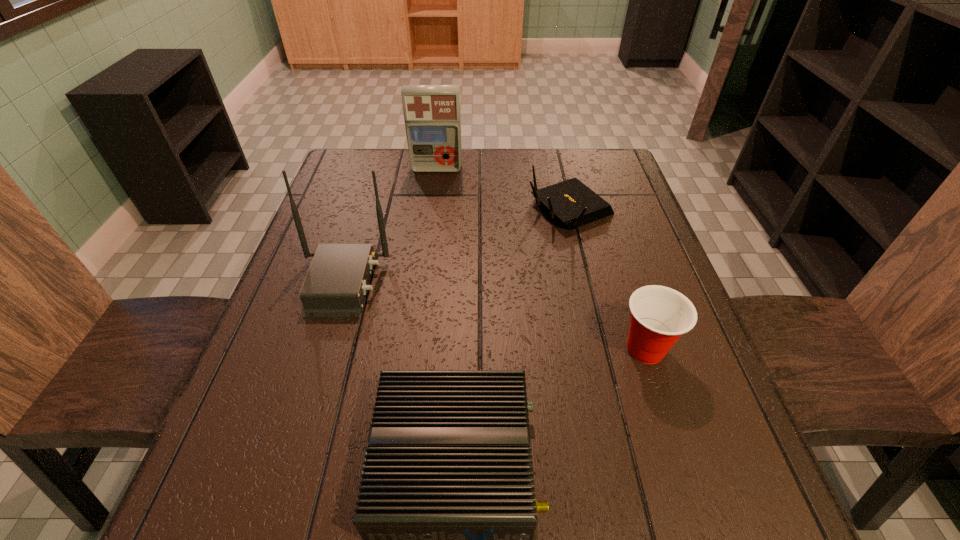
You are a GUI agent. You are given a task and a screenshot of the screen. Output one action in this format:
    pyautogui.click(x=<x>, y=<y>)
    Task: Click on the first-aid kit
    The height and width of the screenshot is (540, 960).
    Given the screenshot: What is the action you would take?
    pyautogui.click(x=432, y=116)

This screenshot has width=960, height=540. I want to click on the leftmost router, so click(x=335, y=286).

Identify the location of the tallest router. This screenshot has width=960, height=540. (335, 286).

Where is `the fourth farthest object`? This screenshot has height=540, width=960. the fourth farthest object is located at coordinates (659, 315).

Locate an element on the screen. This screenshot has height=540, width=960. the third shortest object is located at coordinates (659, 315).

At what (x,y) coordinates should I click in order to perform the action: click on the rightmost router. Please return your answer as a coordinate pair (x, y). Looking at the image, I should click on (572, 203).

Locate an element on the screen. The image size is (960, 540). the fourth nearest object is located at coordinates (572, 203).

What are the coordinates of `blank area located on the front-facing side of the first-aid kit` in the screenshot? It's located at (426, 247).

Locate an element on the screen. The image size is (960, 540). free region located on the back of the third nearest object to connect cables is located at coordinates (513, 283).

I want to click on blank space located 0.210m on the front of the cup, so click(691, 490).